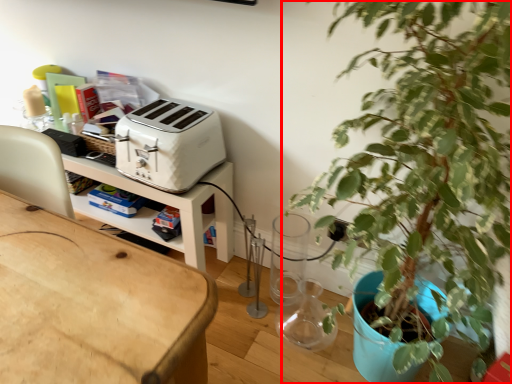
Question: From the image's perspective, where is houseplant (annotated by the red box) located in relation to toaster in the image?

Choices:
 (A) below
 (B) above

Answer: (A)